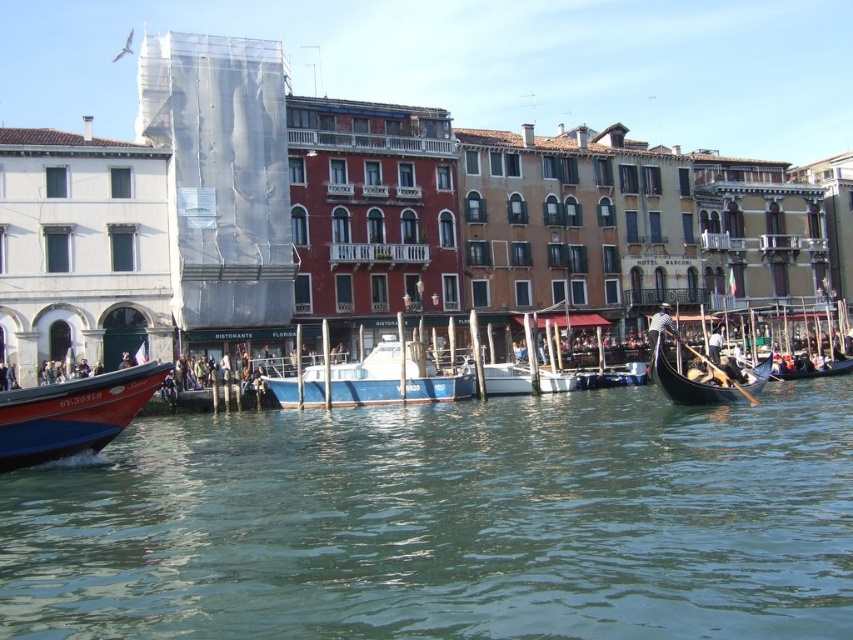
You are a tourist standing on the canal bridge looking down. You see the red glossy boat at lower left and the black polished wood gondola at center. Which boat is closer to you?

The red glossy boat at lower left is closer to you because it is positioned under the black polished wood gondola at center, meaning it is in front of the gondola from your perspective.

You are a tour guide leading a group along the canal. You want to point out the red glossy boat at lower left and the black polished wood gondola at center. Which boat is narrower in width?

The red glossy boat at lower left is thinner than the black polished wood gondola at center, so it is narrower in width.